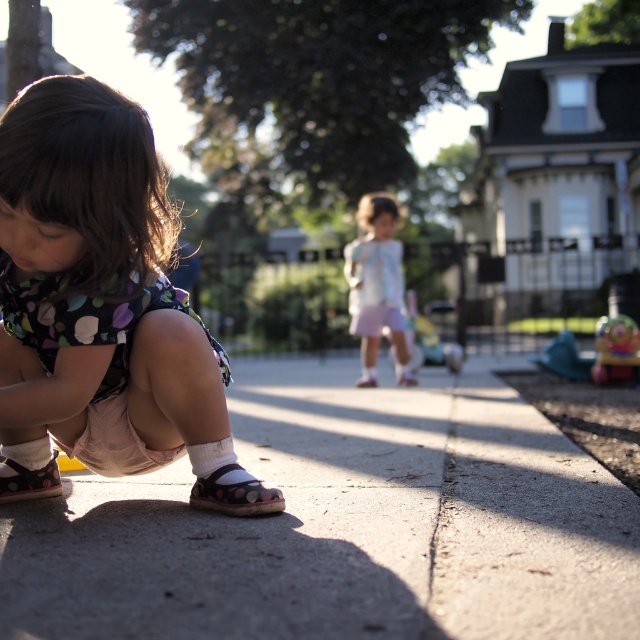
Question: Considering the real-world distances, which object is closest to the polka dot fabric sandal at lower left?

Choices:
 (A) polka dot fabric dress at lower left
 (B) light blue fabric dress at center
 (C) brown fabric sandal at lower left
 (D) gray concrete pavement at lower center

Answer: (A)

Question: Is polka dot fabric dress at lower left further to the viewer compared to light blue fabric dress at center?

Choices:
 (A) yes
 (B) no

Answer: (B)

Question: In this image, where is gray concrete pavement at lower center located relative to polka dot fabric dress at lower left?

Choices:
 (A) left
 (B) right

Answer: (B)

Question: Which of the following is the farthest from the observer?

Choices:
 (A) (40, 481)
 (B) (256, 394)
 (C) (384, 205)
 (D) (600, 336)

Answer: (C)

Question: Which is nearer to the matte plastic toy at lower right?

Choices:
 (A) gray concrete pavement at lower center
 (B) light blue fabric dress at center
 (C) polka dot fabric sandal at lower left
 (D) brown fabric sandal at lower left

Answer: (B)

Question: Considering the relative positions of polka dot fabric dress at lower left and matte plastic toy at lower right in the image provided, where is polka dot fabric dress at lower left located with respect to matte plastic toy at lower right?

Choices:
 (A) left
 (B) right

Answer: (A)